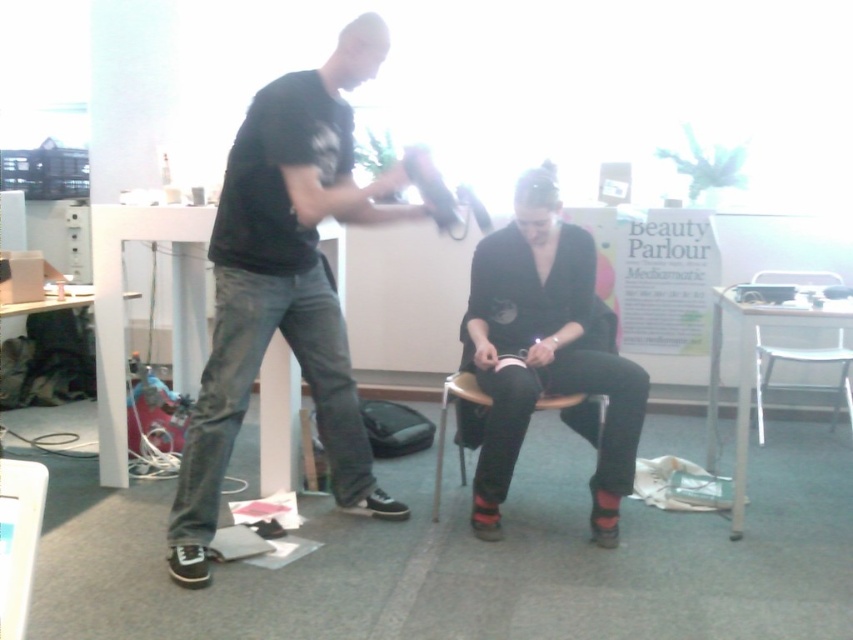
From the picture: You are a fashion designer observing a man in a black matte shirt at center and a woman in a matte black dress at center. Which clothing item is taller?

The black matte shirt at center is taller than the matte black dress at center.

You are organizing a photoshoot and need to ensure that the black matte shirt at center and the metallic silver chair at lower right are both visible in the frame. Given their sizes, which object might require more space horizontally to fit properly into the photo?

The black matte shirt at center requires more horizontal space because its width surpasses that of the metallic silver chair at lower right.

You are a fashion designer observing the scene. You notice the matte black dress at center and the metallic silver chair at lower right. Which object is positioned higher in the image?

The matte black dress at center is above the metallic silver chair at lower right, so the matte black dress at center is positioned higher in the image.